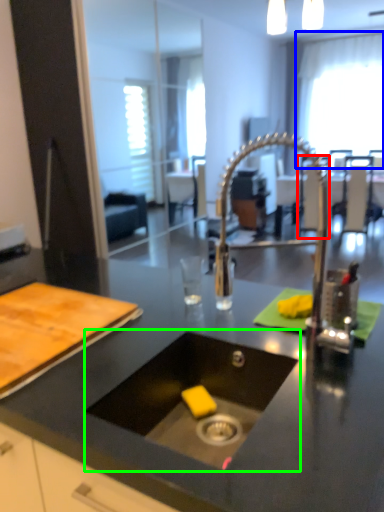
Question: Considering the real-world distances, which object is farthest from chair (highlighted by a red box)? window screen (highlighted by a blue box) or sink (highlighted by a green box)?

Choices:
 (A) window screen
 (B) sink

Answer: (A)